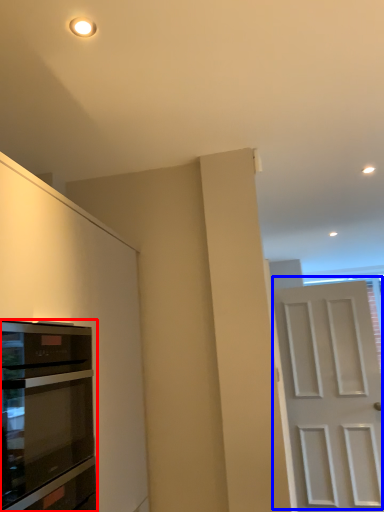
Question: Which object is closer to the camera taking this photo, oven (highlighted by a red box) or door (highlighted by a blue box)?

Choices:
 (A) oven
 (B) door

Answer: (A)